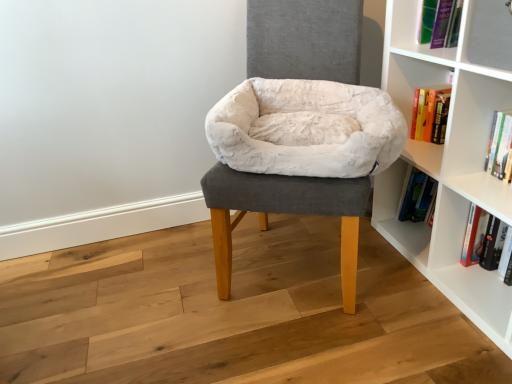
Describe the element at coordinates (500, 147) in the screenshot. Image resolution: width=512 pixels, height=384 pixels. I see `hardcover book at upper right, the 2th book ordered from the bottom` at that location.

Find the location of a particular element. The height and width of the screenshot is (384, 512). white plush pet bed at center is located at coordinates (298, 159).

Which of these two, hardcover book at lower right, which is counted as the 2th book, starting from the top, or white plush pet bed at center, stands taller?

With more height is white plush pet bed at center.

I want to click on chair on the left side of hardcover book at lower right, which is counted as the 2th book, starting from the top, so click(298, 159).

Is point (484, 232) more distant than point (357, 225)?

Yes, it is behind point (357, 225).

Is hardcover book at lower right, which is the first book in bottom-to-top order, bigger or smaller than hardcover book at upper right, the 2th book ordered from the bottom?

hardcover book at lower right, which is the first book in bottom-to-top order, is bigger than hardcover book at upper right, the 2th book ordered from the bottom.

Identify the location of book located below the hardcover book at upper right, the first book from the top (from the image's perspective). (483, 239).

In the scene shown: Which of these two, hardcover book at lower right, which is counted as the 2th book, starting from the top, or hardcover book at upper right, the first book from the top, is thinner?

Thinner between the two is hardcover book at upper right, the first book from the top.

From a real-world perspective, does hardcover book at lower right, which is counted as the 2th book, starting from the top, sit lower than hardcover book at upper right, the 2th book ordered from the bottom?

Correct, in the physical world, hardcover book at lower right, which is counted as the 2th book, starting from the top, is lower than hardcover book at upper right, the 2th book ordered from the bottom.

Are white glossy bookshelf at upper right and hardcover book at upper right, the first book from the top, far apart?

That's not correct — white glossy bookshelf at upper right is a little close to hardcover book at upper right, the first book from the top.

Consider the image. Considering the positions of objects white glossy bookshelf at upper right and hardcover book at upper right, the first book from the top, in the image provided, who is more to the right, white glossy bookshelf at upper right or hardcover book at upper right, the first book from the top,?

hardcover book at upper right, the first book from the top.

Which book is the 1st one when counting from the right side of the white glossy bookshelf at upper right? Please provide its 2D coordinates.

[(500, 147)]

What are the coordinates of `chair that is in front of the white glossy bookshelf at upper right` in the screenshot? It's located at (298, 159).

Is white plush pet bed at center taller or shorter than white glossy bookshelf at upper right?

Clearly, white plush pet bed at center is taller compared to white glossy bookshelf at upper right.

From a real-world perspective, is white plush pet bed at center above or below white glossy bookshelf at upper right?

In terms of real-world spatial position, white plush pet bed at center is below white glossy bookshelf at upper right.

Does white plush pet bed at center have a lesser width compared to white glossy bookshelf at upper right?

Incorrect, the width of white plush pet bed at center is not less than that of white glossy bookshelf at upper right.

Considering the sizes of objects hardcover book at upper right, the first book from the top, and white plush pet bed at center in the image provided, who is wider, hardcover book at upper right, the first book from the top, or white plush pet bed at center?

Wider between the two is white plush pet bed at center.

Is hardcover book at upper right, the first book from the top, positioned beyond the bounds of white plush pet bed at center?

Absolutely, hardcover book at upper right, the first book from the top, is external to white plush pet bed at center.

In terms of height, does white plush pet bed at center look taller or shorter compared to hardcover book at lower right, which is counted as the 2th book, starting from the top?

Considering their sizes, white plush pet bed at center has more height than hardcover book at lower right, which is counted as the 2th book, starting from the top.

From the image's perspective, relative to hardcover book at lower right, which is counted as the 2th book, starting from the top, is white plush pet bed at center above or below?

From the image's perspective, white plush pet bed at center appears above hardcover book at lower right, which is counted as the 2th book, starting from the top.

Can you tell me how much white plush pet bed at center and hardcover book at lower right, which is the first book in bottom-to-top order, differ in facing direction?

The angular difference between white plush pet bed at center and hardcover book at lower right, which is the first book in bottom-to-top order, is 59.7 degrees.

Is hardcover book at lower right, which is counted as the 2th book, starting from the top, surrounded by white plush pet bed at center?

Actually, hardcover book at lower right, which is counted as the 2th book, starting from the top, is outside white plush pet bed at center.

Is hardcover book at lower right, which is counted as the 2th book, starting from the top, positioned behind white glossy bookshelf at upper right?

Yes, hardcover book at lower right, which is counted as the 2th book, starting from the top, is further from the camera.

Does hardcover book at lower right, which is counted as the 2th book, starting from the top, appear on the left side of white glossy bookshelf at upper right?

In fact, hardcover book at lower right, which is counted as the 2th book, starting from the top, is to the right of white glossy bookshelf at upper right.

Is hardcover book at lower right, which is counted as the 2th book, starting from the top, in contact with white glossy bookshelf at upper right?

No, hardcover book at lower right, which is counted as the 2th book, starting from the top, is not touching white glossy bookshelf at upper right.

From the image's perspective, starting from the white plush pet bed at center, which book is the 2nd one below? Please provide its 2D coordinates.

[(483, 239)]

At what (x,y) coordinates should I click in order to perform the action: click on book above the hardcover book at lower right, which is the first book in bottom-to-top order (from the image's perspective). Please return your answer as a coordinate pair (x, y). The height and width of the screenshot is (384, 512). Looking at the image, I should click on (500, 147).

When comparing their distances from hardcover book at lower right, which is the first book in bottom-to-top order, does hardcover book at upper right, the first book from the top, or white plush pet bed at center seem closer?

hardcover book at upper right, the first book from the top, lies closer to hardcover book at lower right, which is the first book in bottom-to-top order, than the other object.

From the image, which object appears to be nearer to hardcover book at upper right, the first book from the top, white plush pet bed at center or white glossy bookshelf at upper right?

Based on the image, white glossy bookshelf at upper right appears to be nearer to hardcover book at upper right, the first book from the top.

Based on their spatial positions, is hardcover book at lower right, which is the first book in bottom-to-top order, or white glossy bookshelf at upper right further from white plush pet bed at center?

Among the two, hardcover book at lower right, which is the first book in bottom-to-top order, is located further to white plush pet bed at center.

Looking at the image, which one is located further to hardcover book at lower right, which is the first book in bottom-to-top order, white plush pet bed at center or white glossy bookshelf at upper right?

white plush pet bed at center.

When comparing their distances from white glossy bookshelf at upper right, does hardcover book at lower right, which is the first book in bottom-to-top order, or white plush pet bed at center seem further?

hardcover book at lower right, which is the first book in bottom-to-top order, is further to white glossy bookshelf at upper right.

Consider the image. Looking at the image, which one is located further to white plush pet bed at center, white plush bean bag at center or hardcover book at lower right, which is the first book in bottom-to-top order?

Among the two, hardcover book at lower right, which is the first book in bottom-to-top order, is located further to white plush pet bed at center.

Looking at the image, which one is located closer to hardcover book at lower right, which is the first book in bottom-to-top order, white plush bean bag at center or hardcover book at upper right, the first book from the top?

hardcover book at upper right, the first book from the top, lies closer to hardcover book at lower right, which is the first book in bottom-to-top order, than the other object.

When comparing their distances from white glossy bookshelf at upper right, does white plush bean bag at center or white plush pet bed at center seem further?

The object further to white glossy bookshelf at upper right is white plush pet bed at center.

This screenshot has height=384, width=512. Identify the location of cabinet between white plush pet bed at center and hardcover book at upper right, the 2th book ordered from the bottom, in the horizontal direction. (461, 38).

The image size is (512, 384). Find the location of `bean bag chair between white plush pet bed at center and white glossy bookshelf at upper right from left to right`. bean bag chair between white plush pet bed at center and white glossy bookshelf at upper right from left to right is located at coordinates (303, 147).

Find the location of `cabinet between white plush bean bag at center and hardcover book at upper right, the 2th book ordered from the bottom, from left to right`. cabinet between white plush bean bag at center and hardcover book at upper right, the 2th book ordered from the bottom, from left to right is located at coordinates (461, 38).

Where is `bean bag chair between white plush pet bed at center and hardcover book at lower right, which is the first book in bottom-to-top order, from left to right`? bean bag chair between white plush pet bed at center and hardcover book at lower right, which is the first book in bottom-to-top order, from left to right is located at coordinates point(303,147).